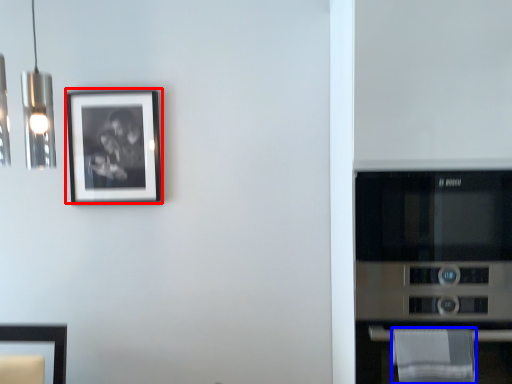
Question: Which point is closer to the camera, picture frame (highlighted by a red box) or cloth (highlighted by a blue box)?

Choices:
 (A) picture frame
 (B) cloth

Answer: (B)